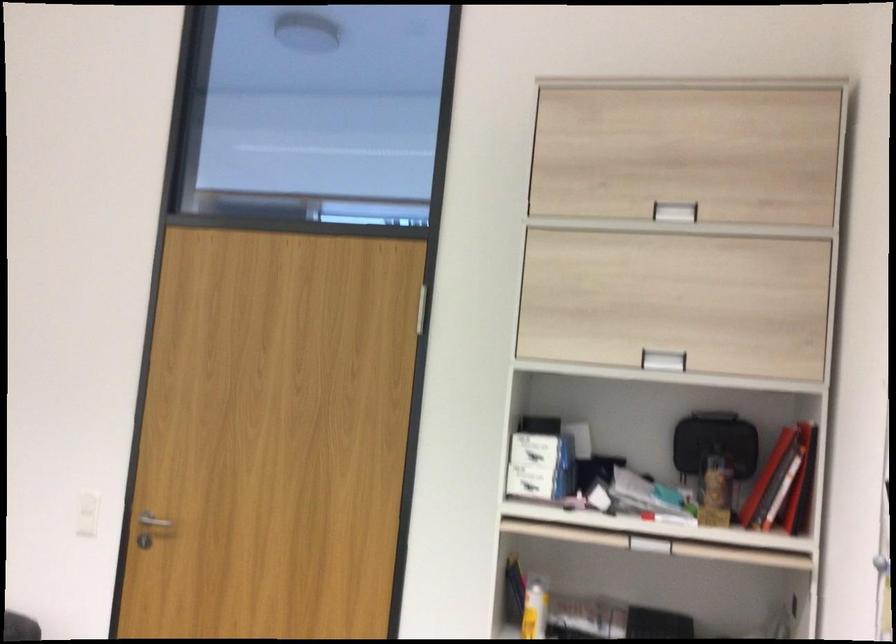
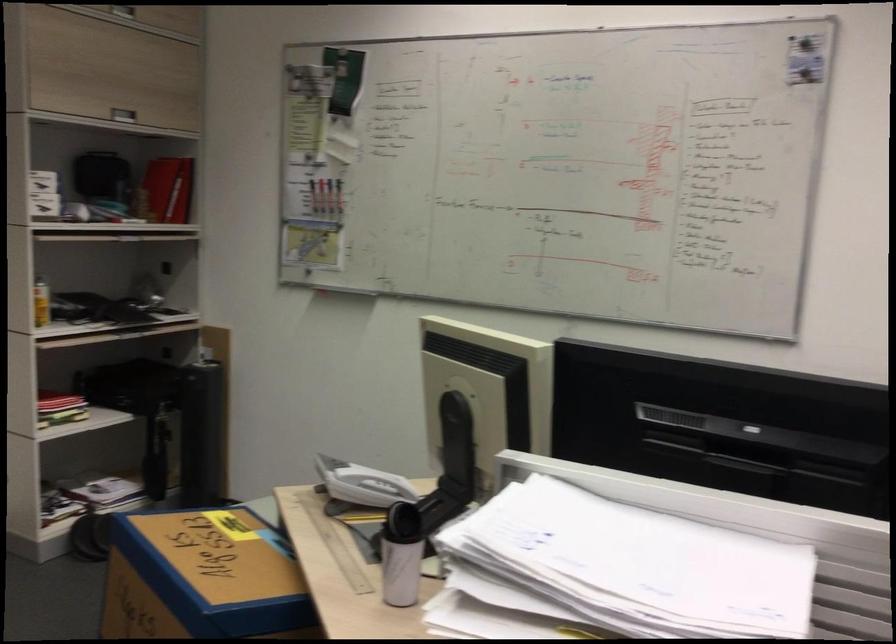
Locate, in the second image, the point that corresponds to the point at 773,476 in the first image.

(166, 190)